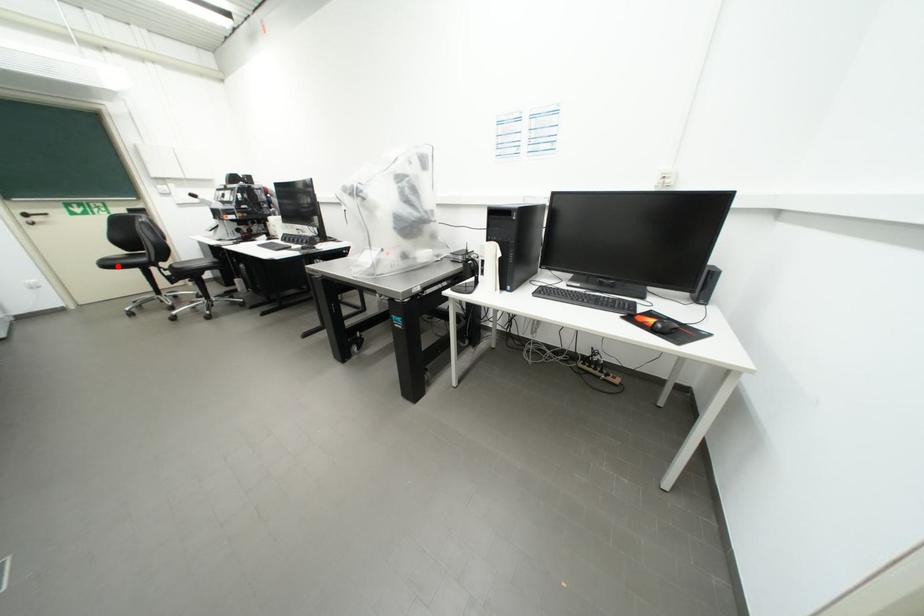
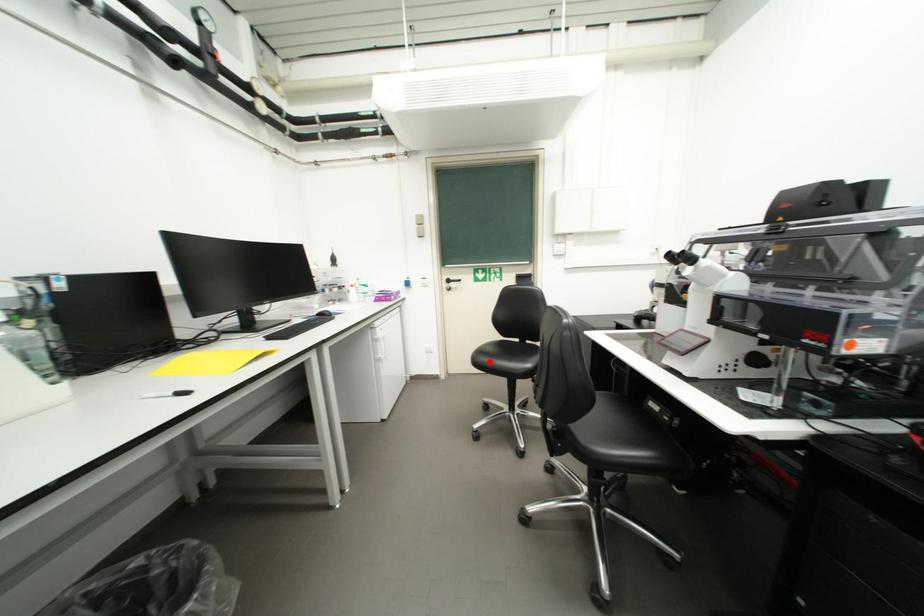
I am providing you with two images of the same scene from different viewpoints. A red point is marked on the first image and another point is marked on the second image. Is the marked point in image1 the same physical position as the marked point in image2?

Yes